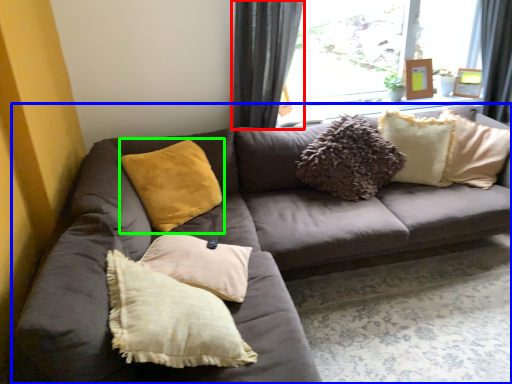
Question: Which is nearer to the curtain (highlighted by a red box)? studio couch (highlighted by a blue box) or pillow (highlighted by a green box).

Choices:
 (A) studio couch
 (B) pillow

Answer: (B)